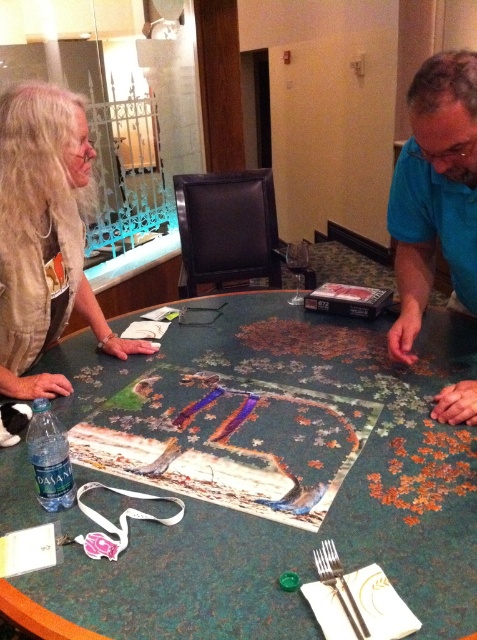
Can you confirm if green marble table at center is positioned to the left of long blonde hair at upper left?

Incorrect, green marble table at center is not on the left side of long blonde hair at upper left.

Is green marble table at center above long blonde hair at upper left?

No.

Who is more distant from viewer, (182, 579) or (0, 317)?

Point (0, 317)

Find the location of a particular element. Image resolution: width=477 pixels, height=640 pixels. green marble table at center is located at coordinates (273, 522).

Is long blonde hair at upper left behind blue matte shirt at upper right?

Yes, it is behind blue matte shirt at upper right.

Consider the image. Does long blonde hair at upper left lie in front of blue matte shirt at upper right?

No, long blonde hair at upper left is further to the viewer.

Which is in front, point (49, 145) or point (418, 214)?

Positioned in front is point (49, 145).

You are a GUI agent. You are given a task and a screenshot of the screen. Output one action in this format:
    pyautogui.click(x=<x>, y=<y>)
    Task: Click on the long blonde hair at upper left
    This screenshot has width=477, height=640.
    Given the screenshot: What is the action you would take?
    pyautogui.click(x=44, y=236)

Who is higher up, blue matte shirt at upper right or silver metallic fork at lower center?

Positioned higher is blue matte shirt at upper right.

Who is shorter, blue matte shirt at upper right or silver metallic fork at lower center?

silver metallic fork at lower center

Find the location of `blue matte shirt at upper right`. blue matte shirt at upper right is located at coordinates (435, 193).